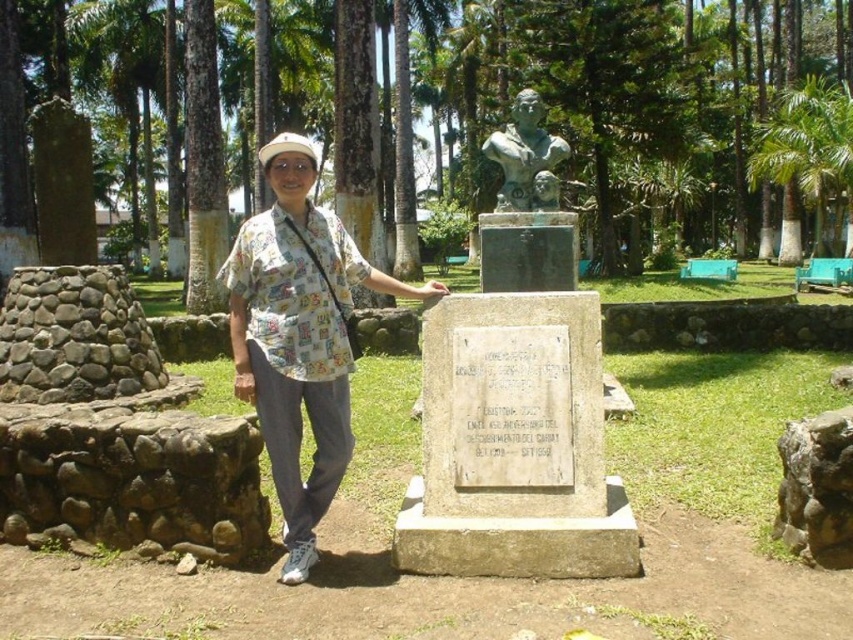
You are standing in the park and want to take a photo of both green leafy palm tree at upper left and green leafy palm tree at upper right. Which palm tree should you focus on first if you want to capture the larger one in your photo?

The green leafy palm tree at upper left is larger in size than the green leafy palm tree at upper right, so you should focus on the green leafy palm tree at upper left first to capture the larger one in your photo.

You are standing in the park and see the printed cotton shirt at center and the green leafy palm tree at upper left. Which object is closer to you?

The printed cotton shirt at center is closer to you since it is in front of the green leafy palm tree at upper left.

You are standing in the park and want to take a photo of the bronze bust at center without any obstructions. Since the green leafy palm tree at upper right is in the way, where should you move to ensure the palm tree is no longer blocking your view?

The bronze bust at center is behind the green leafy palm tree at upper right. To take a photo without obstruction, move to a position where you are behind the bronze bust at center relative to the palm tree, ensuring the palm tree is no longer between you and the bust.